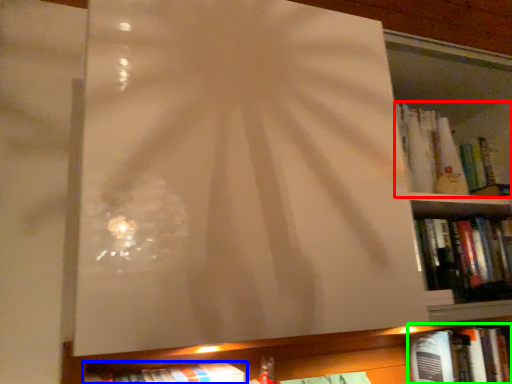
Question: Estimate the real-world distances between objects in this image. Which object is farther from book (highlighted by a red box), book (highlighted by a blue box) or book (highlighted by a green box)?

Choices:
 (A) book
 (B) book

Answer: (A)